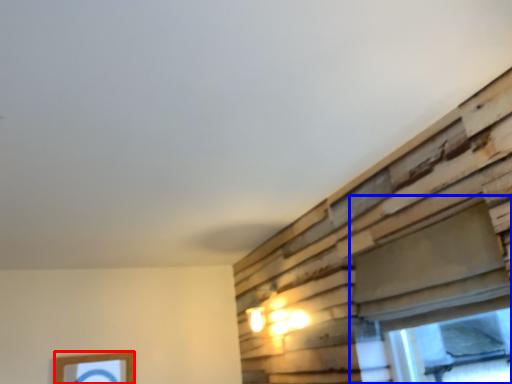
Question: Among these objects, which one is farthest to the camera, picture frame (highlighted by a red box) or window (highlighted by a blue box)?

Choices:
 (A) picture frame
 (B) window

Answer: (A)